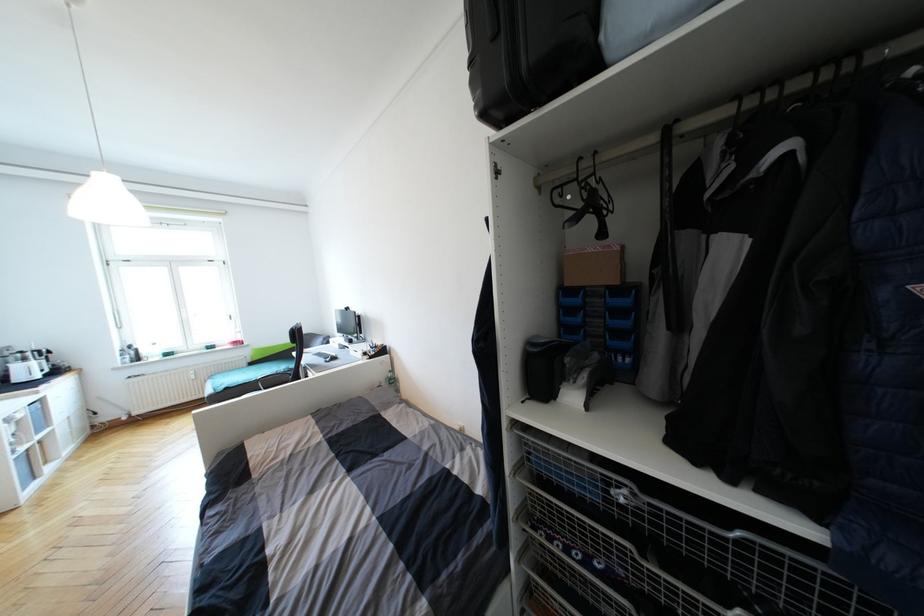
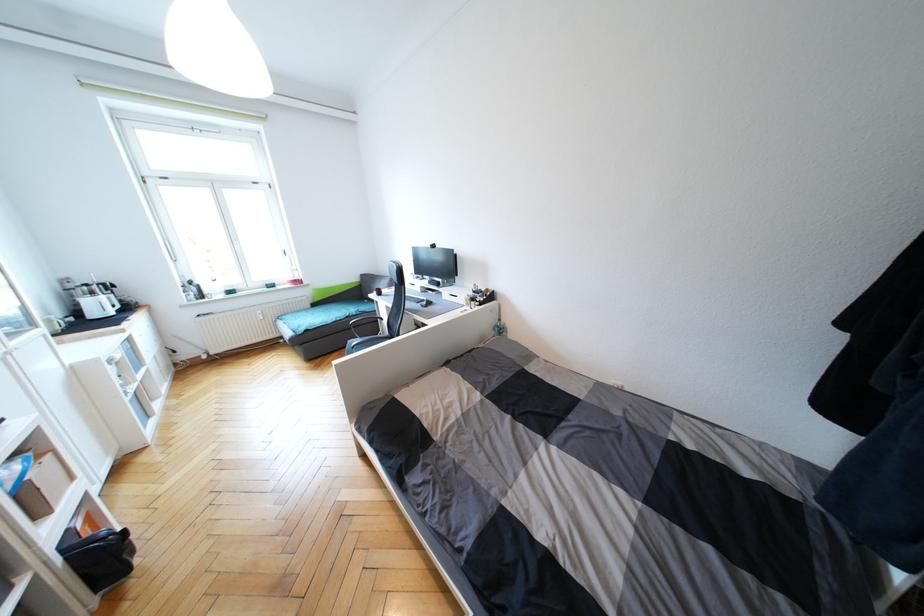
Where in the second image is the point corresponding to point 395,382 from the first image?

(504, 331)